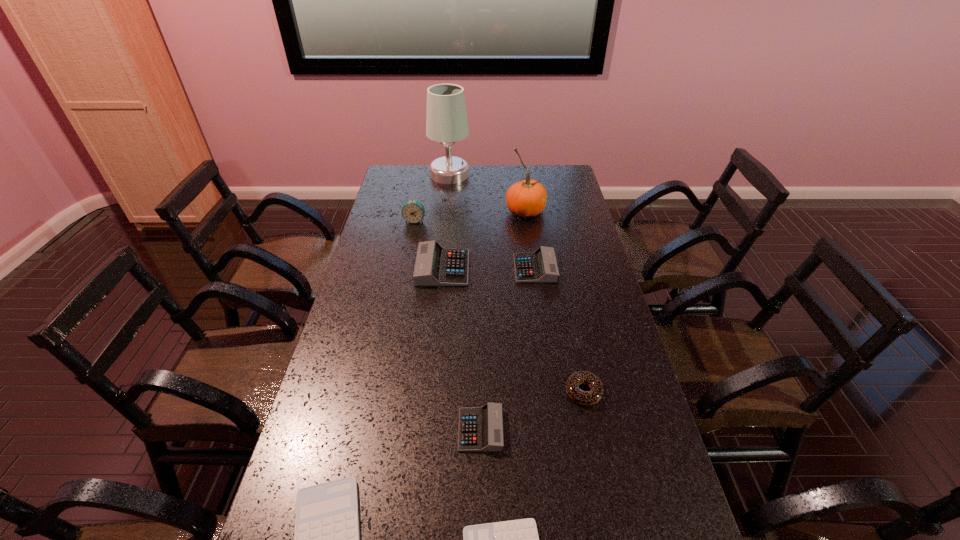
At what (x,y) coordinates should I click in order to perform the action: click on doughnut. Please return your answer as a coordinate pair (x, y). The width and height of the screenshot is (960, 540). Looking at the image, I should click on (591, 397).

At what (x,y) coordinates should I click in order to perform the action: click on the fourth nearest object. Please return your answer as a coordinate pair (x, y). This screenshot has height=540, width=960. Looking at the image, I should click on (591, 397).

At what (x,y) coordinates should I click in order to perform the action: click on the third tallest calculator. Please return your answer as a coordinate pair (x, y). Looking at the image, I should click on (480, 429).

In order to click on the nearest gray calculator in this screenshot , I will do `click(480, 429)`.

Locate an element on the screen. free location located on the base of the lampshade is located at coordinates (446, 208).

Locate an element on the screen. Image resolution: width=960 pixels, height=540 pixels. free space located on the front of the orange pumpkin is located at coordinates (531, 250).

Where is `vacant region located on the front-facing side of the blue alarm clock`? The image size is (960, 540). vacant region located on the front-facing side of the blue alarm clock is located at coordinates (409, 248).

The image size is (960, 540). Find the location of `vacant space located 0.170m on the left of the fourth tallest object`. vacant space located 0.170m on the left of the fourth tallest object is located at coordinates (370, 268).

Identify the location of free location located 0.160m on the front of the rightmost gray calculator. This screenshot has height=540, width=960. (541, 316).

This screenshot has width=960, height=540. Identify the location of vacant area situated 0.240m on the left of the chocolate doughnut. (476, 392).